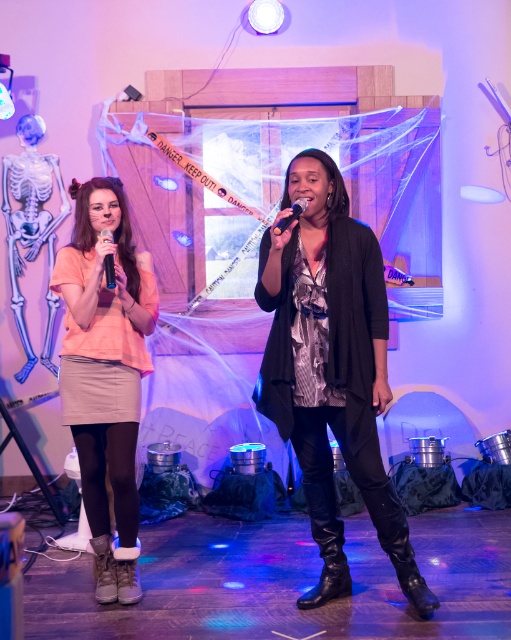
Does black leather boot at lower center lie behind matte black microphone at center?

No, black leather boot at lower center is in front of matte black microphone at center.

Is point (318, 500) in front of point (104, 260)?

Yes, it is.

Measure the distance between point (341, 570) and camera.

Point (341, 570) and camera are 9.57 feet apart from each other.

At what (x,y) coordinates should I click in order to perform the action: click on black leather boot at lower center. Please return your answer as a coordinate pair (x, y). The image size is (511, 640). Looking at the image, I should click on (326, 545).

Is point (79, 225) positioned after point (109, 556)?

Yes, it is.

Between matte peach shirt at left and leather brown boot at lower left, which one has less height?

leather brown boot at lower left

The width and height of the screenshot is (511, 640). I want to click on matte peach shirt at left, so click(x=105, y=362).

Is leather brown boot at lower left below shiny black microphone at center?

Indeed, leather brown boot at lower left is positioned under shiny black microphone at center.

Is leather brown boot at lower left to the left of shiny black microphone at center from the viewer's perspective?

Indeed, leather brown boot at lower left is positioned on the left side of shiny black microphone at center.

Which is behind, point (111, 579) or point (290, 216)?

The point (111, 579) is behind.

Locate an element on the screen. The image size is (511, 640). leather brown boot at lower left is located at coordinates (104, 570).